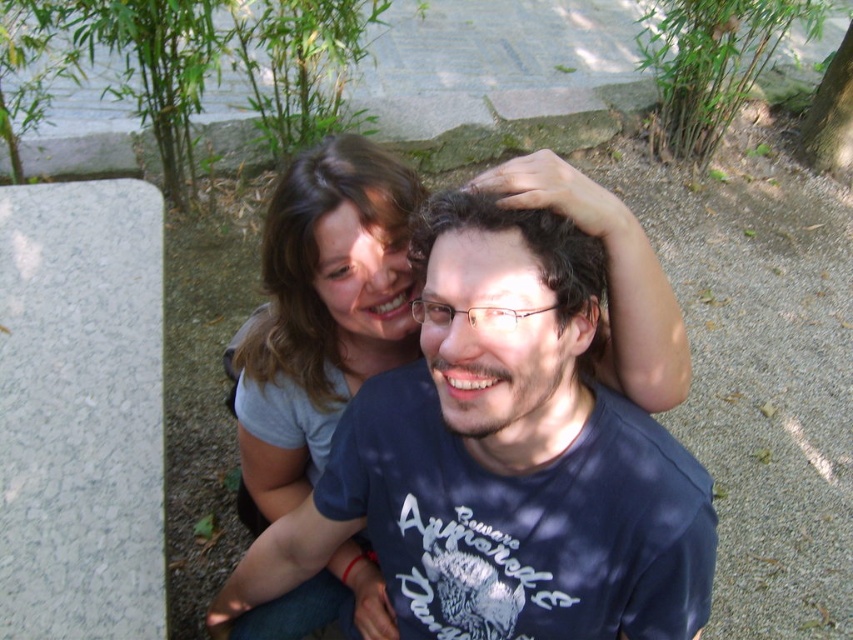
Question: Is blue cotton t-shirt at center above gray matte hair at upper center?

Choices:
 (A) yes
 (B) no

Answer: (B)

Question: Is blue cotton t-shirt at center closer to camera compared to gray matte hair at upper center?

Choices:
 (A) no
 (B) yes

Answer: (B)

Question: Which point is farther to the camera?

Choices:
 (A) (263, 337)
 (B) (451, 493)

Answer: (A)

Question: Does blue cotton t-shirt at center appear over gray matte hair at upper center?

Choices:
 (A) no
 (B) yes

Answer: (A)

Question: Which object is closer to the camera taking this photo?

Choices:
 (A) gray matte hair at upper center
 (B) blue cotton t-shirt at center

Answer: (B)